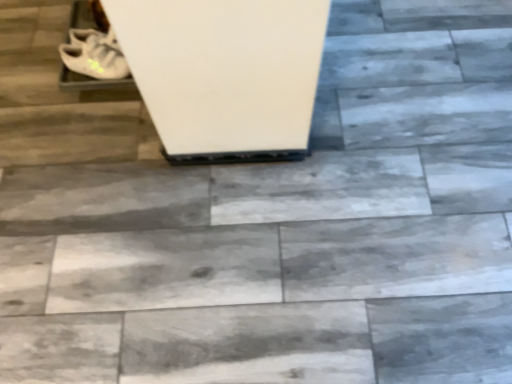
Describe the element at coordinates (94, 59) in the screenshot. I see `white matte shoe at upper left` at that location.

This screenshot has height=384, width=512. Find the location of `white matte shoe at upper left`. white matte shoe at upper left is located at coordinates (94, 59).

What do you see at coordinates (91, 49) in the screenshot? This screenshot has height=384, width=512. I see `white matte shoe at upper left` at bounding box center [91, 49].

Where is `white matte shoe at upper left`? white matte shoe at upper left is located at coordinates (91, 49).

Image resolution: width=512 pixels, height=384 pixels. I want to click on white matte shoe at upper left, so click(94, 59).

Consider the image. Considering the relative positions of white matte shoe at upper left and white matte shoe at upper left in the image provided, is white matte shoe at upper left to the right of white matte shoe at upper left from the viewer's perspective?

Yes.

Is the position of white matte shoe at upper left less distant than that of white matte shoe at upper left?

No, white matte shoe at upper left is behind white matte shoe at upper left.

Between point (112, 77) and point (102, 50), which one is positioned in front?

The point (112, 77) is more forward.

From the image's perspective, which one is positioned higher, white matte shoe at upper left or white matte shoe at upper left?

From the image's view, white matte shoe at upper left is above.

From a real-world perspective, who is located lower, white matte shoe at upper left or white matte shoe at upper left?

white matte shoe at upper left is physically lower.

Does white matte shoe at upper left have a greater width compared to white matte shoe at upper left?

Incorrect, the width of white matte shoe at upper left does not surpass that of white matte shoe at upper left.

In the scene shown: Is white matte shoe at upper left taller than white matte shoe at upper left?

Correct, white matte shoe at upper left is much taller as white matte shoe at upper left.

Considering the relative sizes of white matte shoe at upper left and white matte shoe at upper left in the image provided, is white matte shoe at upper left smaller than white matte shoe at upper left?

Actually, white matte shoe at upper left might be larger than white matte shoe at upper left.

Can white matte shoe at upper left be found inside white matte shoe at upper left?

Definitely not — white matte shoe at upper left is not inside white matte shoe at upper left.

Is white matte shoe at upper left not near white matte shoe at upper left?

No, white matte shoe at upper left is not far away from white matte shoe at upper left.

Is white matte shoe at upper left facing towards white matte shoe at upper left?

No, white matte shoe at upper left is not turned towards white matte shoe at upper left.

Can you tell me how much white matte shoe at upper left and white matte shoe at upper left differ in facing direction?

The angular difference between white matte shoe at upper left and white matte shoe at upper left is 13 degrees.

Measure the distance between white matte shoe at upper left and white matte shoe at upper left.

0.87 inches.

Find the location of a particular element. The image size is (512, 384). shoe in front of the white matte shoe at upper left is located at coordinates (94, 59).

Based on their positions, is white matte shoe at upper left located to the left or right of white matte shoe at upper left?

Clearly, white matte shoe at upper left is on the left of white matte shoe at upper left in the image.

Considering their positions, is white matte shoe at upper left located in front of or behind white matte shoe at upper left?

Clearly, white matte shoe at upper left is in front of white matte shoe at upper left.

Which is more distant, (124, 75) or (117, 78)?

The point (117, 78) is farther from the camera.

From the image's perspective, is white matte shoe at upper left positioned above or below white matte shoe at upper left?

white matte shoe at upper left is situated lower than white matte shoe at upper left in the image.

In the scene shown: From a real-world perspective, is white matte shoe at upper left above or below white matte shoe at upper left?

In terms of real-world spatial position, white matte shoe at upper left is below white matte shoe at upper left.

Which of these two, white matte shoe at upper left or white matte shoe at upper left, is wider?

With larger width is white matte shoe at upper left.

Can you confirm if white matte shoe at upper left is shorter than white matte shoe at upper left?

Correct, white matte shoe at upper left is not as tall as white matte shoe at upper left.

Considering the sizes of objects white matte shoe at upper left and white matte shoe at upper left in the image provided, who is bigger, white matte shoe at upper left or white matte shoe at upper left?

Bigger between the two is white matte shoe at upper left.

Do you think white matte shoe at upper left is within white matte shoe at upper left, or outside of it?

white matte shoe at upper left exists outside the volume of white matte shoe at upper left.

Looking at this image, is white matte shoe at upper left next to white matte shoe at upper left and touching it?

Yes, white matte shoe at upper left and white matte shoe at upper left clearly make contact.

Is white matte shoe at upper left turned away from white matte shoe at upper left?

No, white matte shoe at upper left is not at the back of white matte shoe at upper left.

What's the angular difference between white matte shoe at upper left and white matte shoe at upper left's facing directions?

13 degrees separate the facing orientations of white matte shoe at upper left and white matte shoe at upper left.

How much distance is there between white matte shoe at upper left and white matte shoe at upper left?

white matte shoe at upper left and white matte shoe at upper left are 0.87 inches apart from each other.

This screenshot has height=384, width=512. In order to click on footwear located above the white matte shoe at upper left (from the image's perspective) in this screenshot , I will do `click(91, 49)`.

Image resolution: width=512 pixels, height=384 pixels. What are the coordinates of `footwear above the white matte shoe at upper left (from the image's perspective)` in the screenshot? It's located at (91, 49).

In order to click on footwear lying on the right of white matte shoe at upper left in this screenshot , I will do (91, 49).